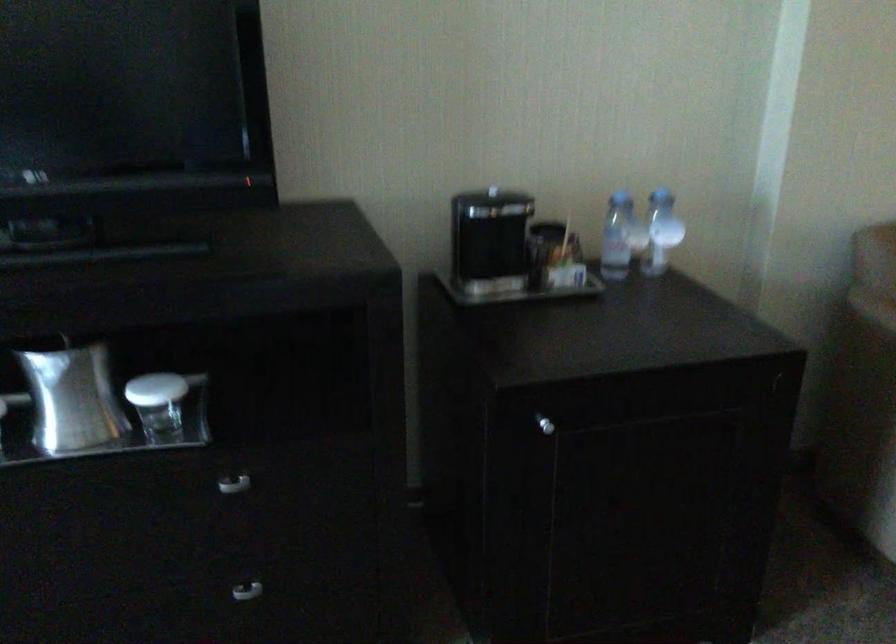
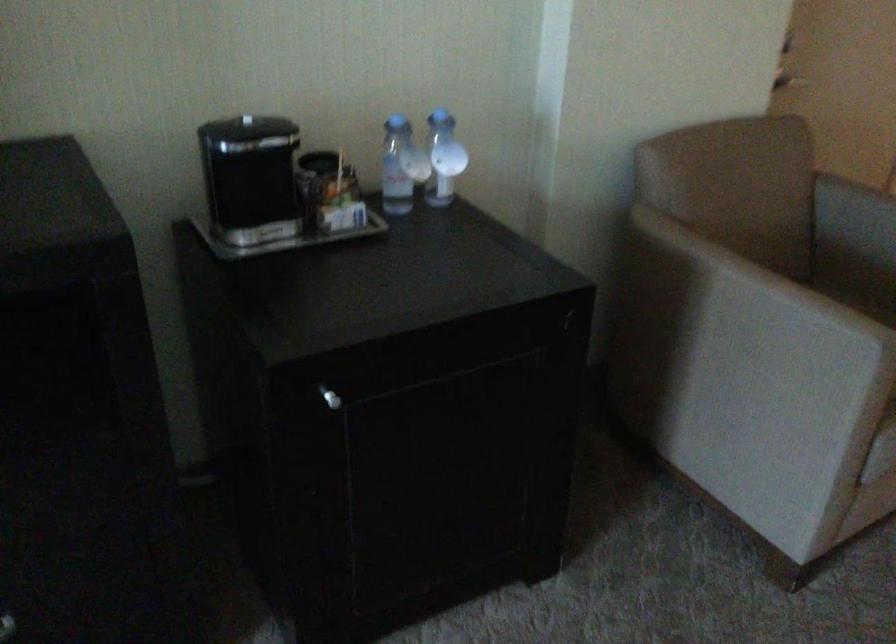
Question: The images are taken continuously from a first-person perspective. In which direction are you moving?

Choices:
 (A) Left
 (B) Right
 (C) Forward
 (D) Backward

Answer: (C)